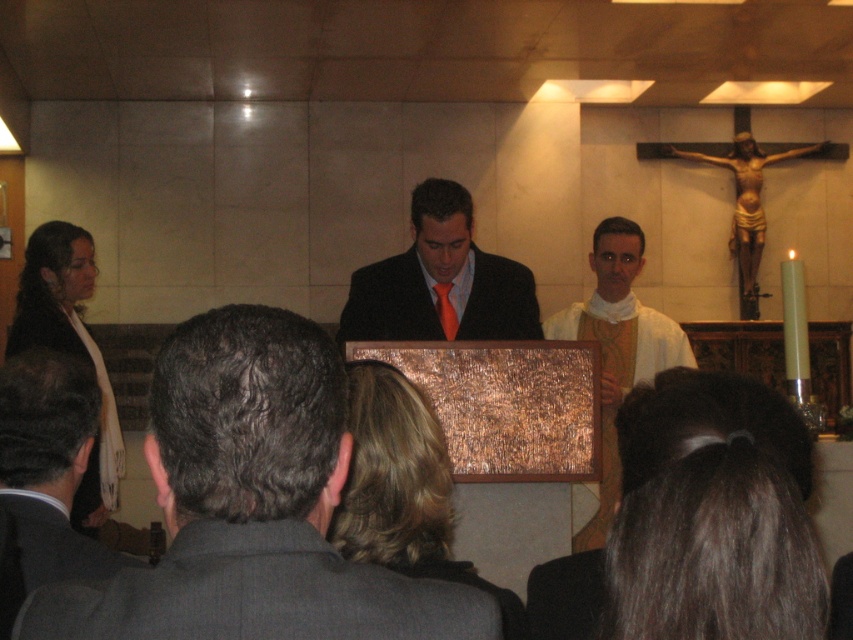
You are attending a formal event and notice the matte black suit at center and the white cloth at center. Which object takes up more space in the image?

The white cloth at center takes up more space in the image because the matte black suit at center is smaller than the white cloth at center.

You are attending a ceremony and need to place a small flower bouquet on the white cloth at center. Where should you place it relative to the matte black suit at center?

The matte black suit at center is above the white cloth at center, so you should place the bouquet below the matte black suit at center to position it on the white cloth at center.

You are standing at the position of the gray wool suit at lower left and want to walk to the matte black suit at center. How many steps would you need to take if each step covers 0.75 meters?

The distance between the gray wool suit at lower left and the matte black suit at center is 3.06 meters. Since each step covers 0.75 meters, dividing 3.06 by 0.75 gives approximately 4.08 steps. Therefore, you would need to take 5 steps to reach the matte black suit at center.